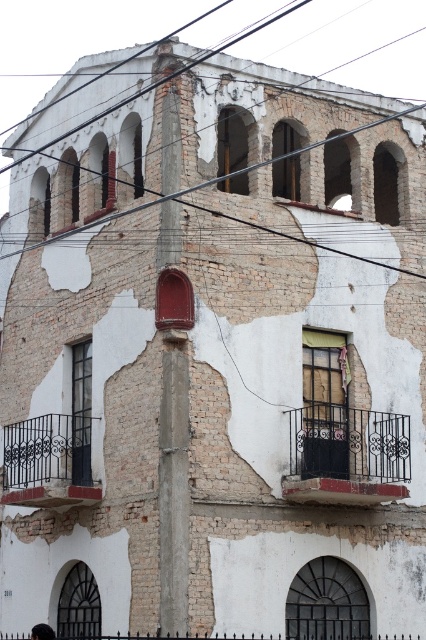
Does black wrought iron balcony at lower right have a lesser width compared to black wire at upper center?

Yes, black wrought iron balcony at lower right is thinner than black wire at upper center.

Can you confirm if black wrought iron balcony at lower right is positioned above black wire at upper center?

Actually, black wrought iron balcony at lower right is below black wire at upper center.

Who is more forward, (333,413) or (83,128)?

Point (333,413) is more forward.

Image resolution: width=426 pixels, height=640 pixels. I want to click on black wrought iron balcony at lower right, so click(x=347, y=456).

Can you confirm if black wrought iron balcony at lower left is thinner than dark brown hair at lower left?

In fact, black wrought iron balcony at lower left might be wider than dark brown hair at lower left.

Does black wrought iron balcony at lower left appear over dark brown hair at lower left?

Correct, black wrought iron balcony at lower left is located above dark brown hair at lower left.

Which is in front, point (28, 442) or point (46, 634)?

Point (46, 634) is in front.

You are a GUI agent. You are given a task and a screenshot of the screen. Output one action in this format:
    pyautogui.click(x=<x>, y=<y>)
    Task: Click on the black wrought iron balcony at lower left
    The height and width of the screenshot is (640, 426).
    Given the screenshot: What is the action you would take?
    pyautogui.click(x=48, y=461)

Does black wire at upper center have a smaller size compared to dark brown hair at lower left?

Incorrect, black wire at upper center is not smaller in size than dark brown hair at lower left.

You are a GUI agent. You are given a task and a screenshot of the screen. Output one action in this format:
    pyautogui.click(x=<x>, y=<y>)
    Task: Click on the black wire at upper center
    This screenshot has width=426, height=640.
    Given the screenshot: What is the action you would take?
    pyautogui.click(x=123, y=90)

Locate an element on the screen. Image resolution: width=426 pixels, height=640 pixels. black wire at upper center is located at coordinates click(x=123, y=90).